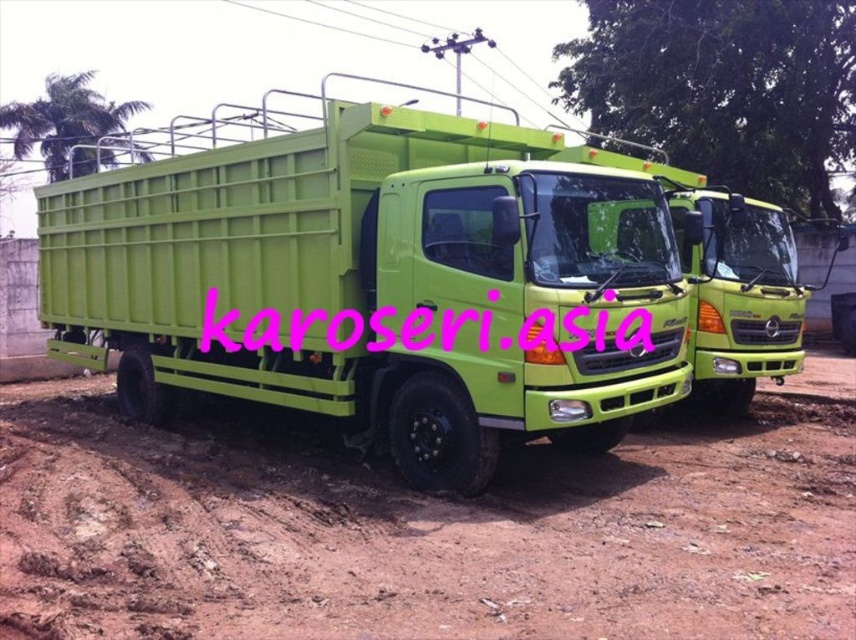
You are a delivery driver who needs to transport a large package that requires a minimum height clearance of 2 meters. You see the lime green plastic truck at center and the brown dirt track at lower center. Which vehicle has sufficient height to accommodate the package?

The lime green plastic truck at center has a greater height compared to the brown dirt track at lower center, so it can accommodate the package with the required 2 meters height clearance.

You are a toy collector who wants to display both the lime green plastic truck at center and the brown dirt track at lower center on a shelf. Given that the shelf has limited space, which object should you prioritize placing first to ensure both fit?

The lime green plastic truck at center is larger in size than the brown dirt track at lower center, so you should place the lime green plastic truck at center first to ensure both fit on the shelf.